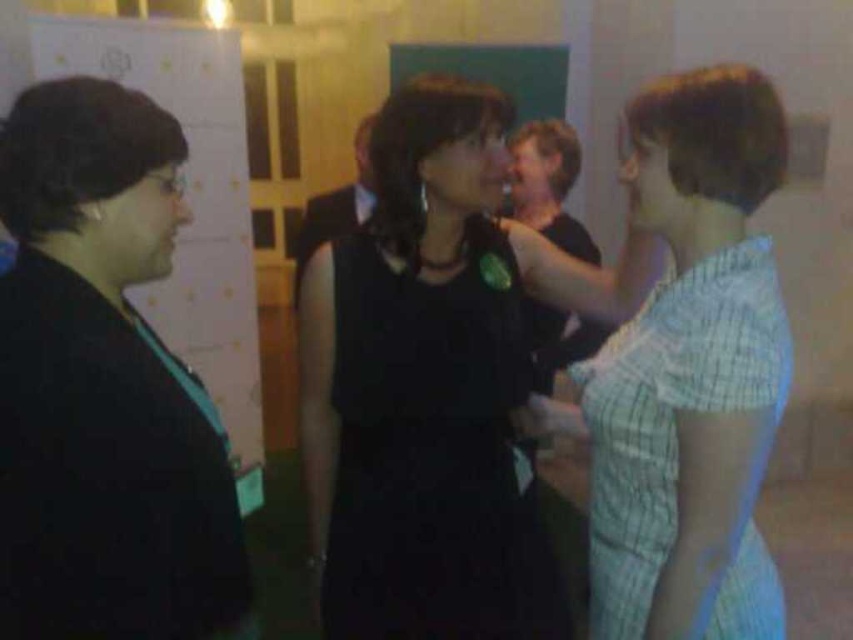
You are a photographer at the event and need to capture a photo where both the black matte jacket at left and the black matte dress at center are clearly visible. Based on their positions, which one might you need to adjust your camera angle to ensure it is fully in frame?

The black matte jacket at left is in front of the black matte dress at center, so you might need to adjust your camera angle to ensure the black matte dress at center is fully visible as it might be partially obscured.

You are a photographer at the event and want to take a photo of the black matte jacket at left and the light blue checkered dress at right. Based on their positions, which one will be more visible in the photo?

The black matte jacket at left will be more visible in the photo because it is in front of the light blue checkered dress at right.